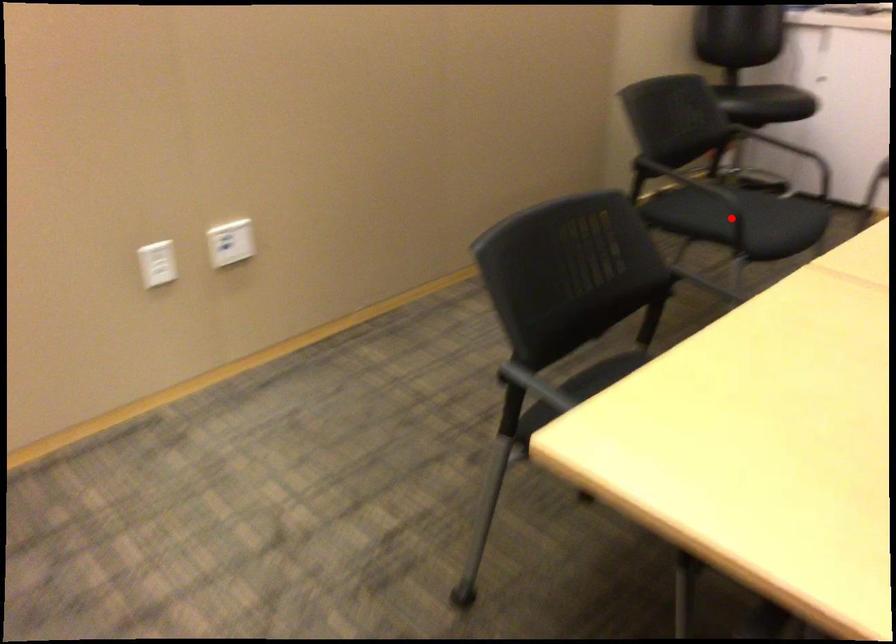
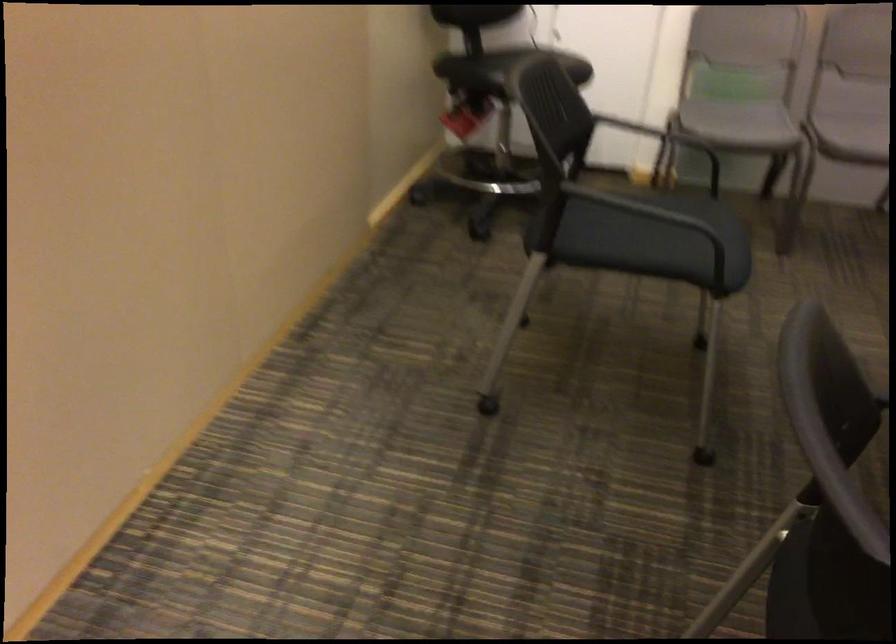
The point at the highlighted location is marked in the first image. Where is the corresponding point in the second image?

(655, 240)